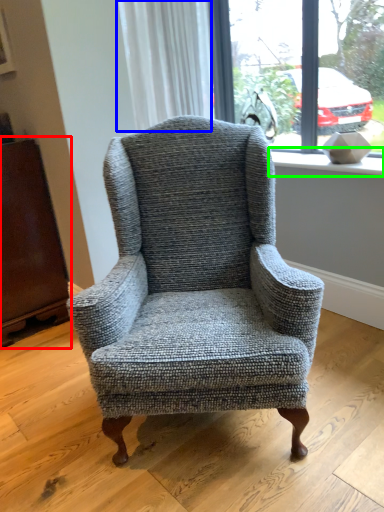
Question: Which object is the closest to the armoire (highlighted by a red box)? Choose among these: curtain (highlighted by a blue box) or window sill (highlighted by a green box).

Choices:
 (A) curtain
 (B) window sill

Answer: (A)